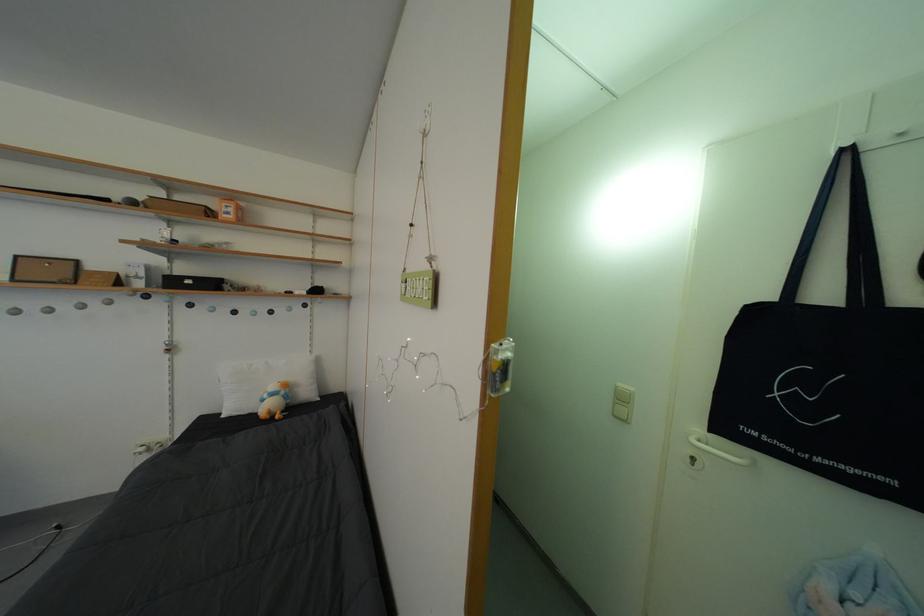
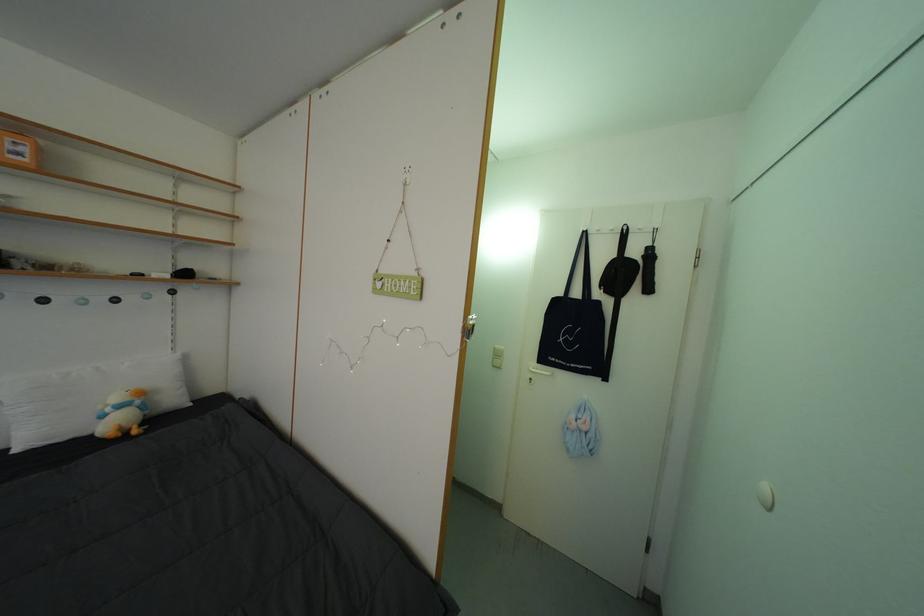
In the second image, find the point that corresponds to (x=295, y=403) in the first image.

(152, 413)